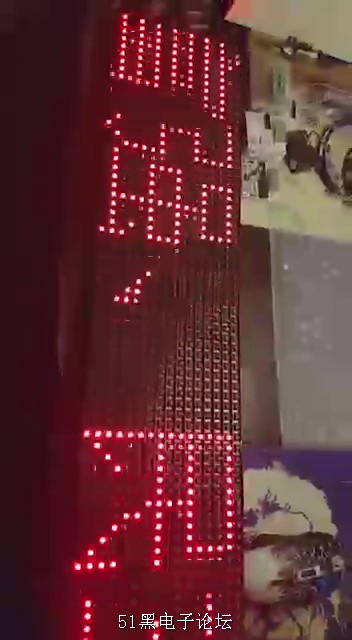
Image resolution: width=352 pixels, height=640 pixels. What are the coordinates of `lighted wall` in the screenshot? It's located at (178, 347).